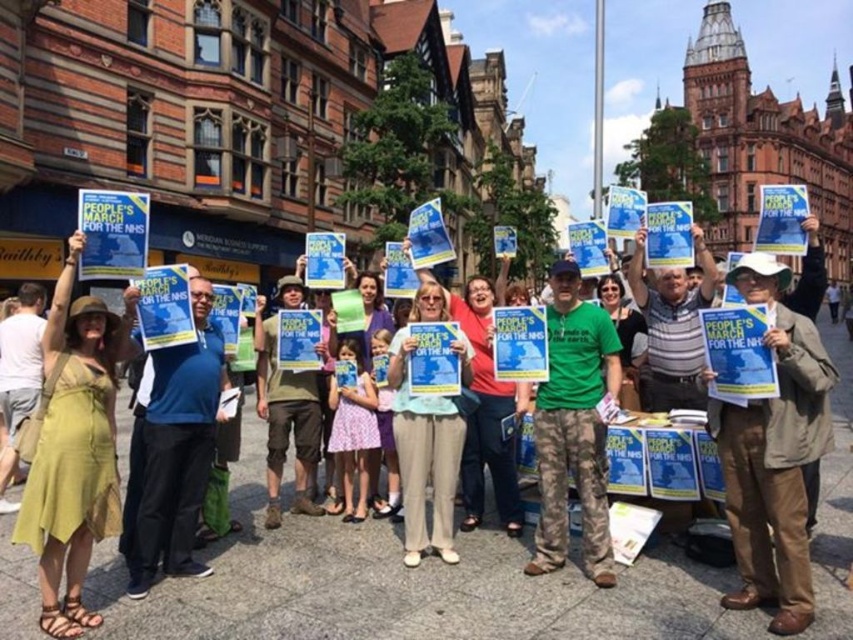
Is light beige pants at center wider than camouflage pants at center?

Incorrect, light beige pants at center's width does not surpass camouflage pants at center's.

The image size is (853, 640). What do you see at coordinates (424, 440) in the screenshot?
I see `light beige pants at center` at bounding box center [424, 440].

Where is `light beige pants at center`? The width and height of the screenshot is (853, 640). light beige pants at center is located at coordinates click(x=424, y=440).

Which is in front, point (184, 586) or point (543, 458)?

Point (184, 586) is in front.

Measure the distance from matte blue poster at center to green matte t-shirt at center.

A distance of 7.02 meters exists between matte blue poster at center and green matte t-shirt at center.

Does point (125, 620) come behind point (613, 348)?

No.

Locate an element on the screen. This screenshot has height=640, width=853. matte blue poster at center is located at coordinates (405, 586).

Is point (805, 324) positioned in front of point (409, 328)?

Yes, point (805, 324) is in front of point (409, 328).

From the picture: Can you confirm if brown leather jacket at center is shorter than light beige pants at center?

No, brown leather jacket at center is not shorter than light beige pants at center.

Which is in front, point (785, 317) or point (413, 432)?

Point (785, 317) is more forward.

The image size is (853, 640). In order to click on brown leather jacket at center in this screenshot , I will do `click(775, 454)`.